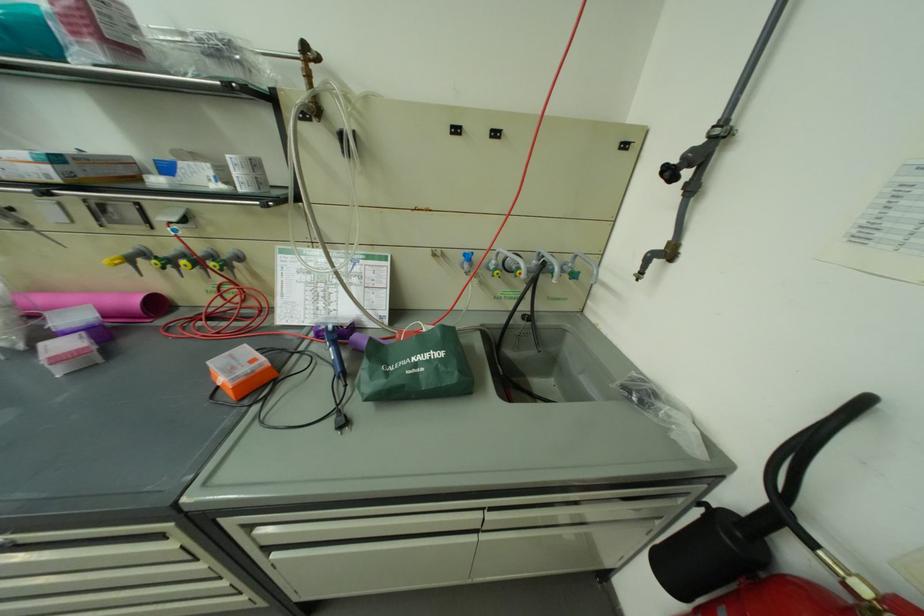
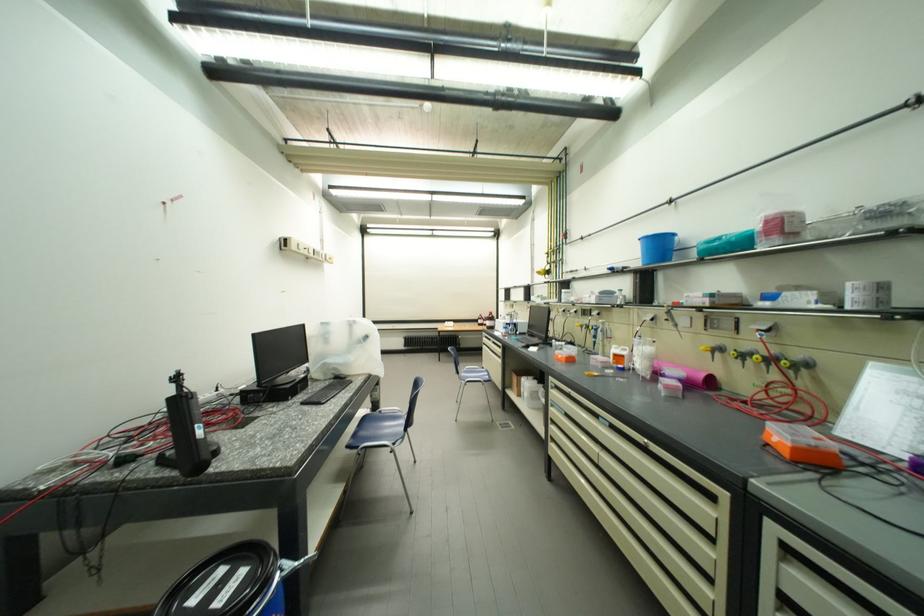
Find the pixel in the second image that matches point 116,262 in the first image.

(712, 350)